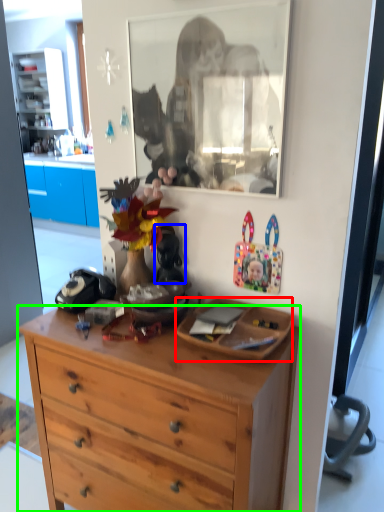
Question: Which is nearer to the picture frame (highlighted by a red box)? toy (highlighted by a blue box) or desk (highlighted by a green box).

Choices:
 (A) toy
 (B) desk

Answer: (B)